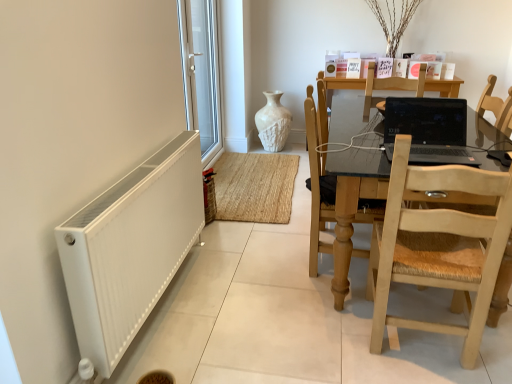
Question: From a real-world perspective, is light wood/rattan chair at right, positioned as the 2th chair in back-to-front order, physically below light brown wooden chair at center, the first chair from the back?

Choices:
 (A) yes
 (B) no

Answer: (B)

Question: Considering the relative positions of light wood/rattan chair at right, the first chair viewed from the front, and light brown wooden chair at center, the first chair from the back, in the image provided, is light wood/rattan chair at right, the first chair viewed from the front, to the right of light brown wooden chair at center, the first chair from the back, from the viewer's perspective?

Choices:
 (A) no
 (B) yes

Answer: (B)

Question: Is light brown wooden chair at center, the first chair from the back, at the back of light wood/rattan chair at right, positioned as the 2th chair in back-to-front order?

Choices:
 (A) yes
 (B) no

Answer: (B)

Question: Considering the relative sizes of light wood/rattan chair at right, positioned as the 2th chair in back-to-front order, and light brown wooden chair at center, the first chair from the back, in the image provided, is light wood/rattan chair at right, positioned as the 2th chair in back-to-front order, thinner than light brown wooden chair at center, the first chair from the back,?

Choices:
 (A) no
 (B) yes

Answer: (A)

Question: Is light wood/rattan chair at right, positioned as the 2th chair in back-to-front order, surrounding light brown wooden chair at center, arranged as the 2th chair when viewed from the front?

Choices:
 (A) no
 (B) yes

Answer: (A)

Question: Is light wood/rattan chair at right, positioned as the 2th chair in back-to-front order, bigger than light brown wooden chair at center, arranged as the 2th chair when viewed from the front?

Choices:
 (A) no
 (B) yes

Answer: (B)

Question: Does light brown wooden chair at center, the first chair from the back, have a larger size compared to white plastic window at left?

Choices:
 (A) yes
 (B) no

Answer: (B)

Question: Can you confirm if light brown wooden chair at center, arranged as the 2th chair when viewed from the front, is thinner than white plastic window at left?

Choices:
 (A) no
 (B) yes

Answer: (A)

Question: Is white plastic window at left completely or partially inside light brown wooden chair at center, arranged as the 2th chair when viewed from the front?

Choices:
 (A) no
 (B) yes

Answer: (A)

Question: From the image's perspective, is light brown wooden chair at center, the first chair from the back, located above white plastic window at left?

Choices:
 (A) no
 (B) yes

Answer: (A)

Question: Can you see light brown wooden chair at center, the first chair from the back, touching white plastic window at left?

Choices:
 (A) no
 (B) yes

Answer: (A)

Question: Is light brown wooden chair at center, the first chair from the back, to the right of white plastic window at left from the viewer's perspective?

Choices:
 (A) no
 (B) yes

Answer: (B)

Question: Is black glossy laptop at center smaller than white textured vase at center?

Choices:
 (A) no
 (B) yes

Answer: (B)